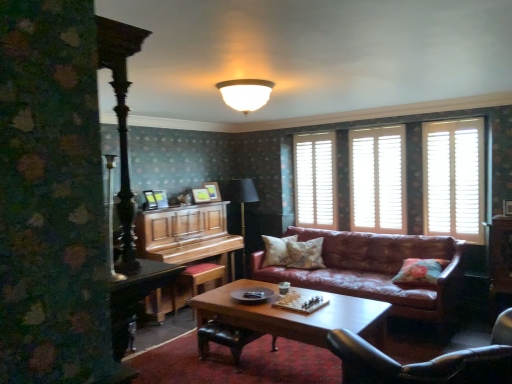
Question: Considering the relative sizes of black leather chair at lower right and white frosted glass lampshade at upper center in the image provided, is black leather chair at lower right thinner than white frosted glass lampshade at upper center?

Choices:
 (A) no
 (B) yes

Answer: (A)

Question: From the image's perspective, is black leather chair at lower right above white frosted glass lampshade at upper center?

Choices:
 (A) yes
 (B) no

Answer: (B)

Question: Would you say black leather chair at lower right is outside white frosted glass lampshade at upper center?

Choices:
 (A) no
 (B) yes

Answer: (B)

Question: From a real-world perspective, does black leather chair at lower right stand above white frosted glass lampshade at upper center?

Choices:
 (A) yes
 (B) no

Answer: (B)

Question: Does black leather chair at lower right appear on the left side of white frosted glass lampshade at upper center?

Choices:
 (A) yes
 (B) no

Answer: (B)

Question: From the image's perspective, does black leather chair at lower right appear lower than white frosted glass lampshade at upper center?

Choices:
 (A) no
 (B) yes

Answer: (B)

Question: Is white frosted glass lampshade at upper center looking in the opposite direction of fluffy beige pillow at center, the second pillow when ordered from left to right?

Choices:
 (A) yes
 (B) no

Answer: (B)

Question: Does white frosted glass lampshade at upper center have a lesser width compared to fluffy beige pillow at center, which is the 2th pillow in right-to-left order?

Choices:
 (A) no
 (B) yes

Answer: (A)

Question: Does white frosted glass lampshade at upper center contain fluffy beige pillow at center, which is the 2th pillow in right-to-left order?

Choices:
 (A) yes
 (B) no

Answer: (B)

Question: Are white frosted glass lampshade at upper center and fluffy beige pillow at center, the second pillow when ordered from left to right, located far from each other?

Choices:
 (A) yes
 (B) no

Answer: (A)

Question: Does white frosted glass lampshade at upper center come behind fluffy beige pillow at center, placed as the second pillow when sorted from back to front?

Choices:
 (A) no
 (B) yes

Answer: (A)

Question: Is the surface of white frosted glass lampshade at upper center in direct contact with fluffy beige pillow at center, the second pillow when ordered from left to right?

Choices:
 (A) no
 (B) yes

Answer: (A)

Question: Is wooden stool at lower left closer to the viewer compared to leather couch at center?

Choices:
 (A) no
 (B) yes

Answer: (A)